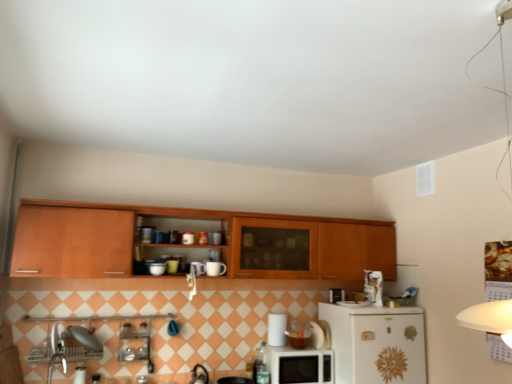
At what (x,y) coordinates should I click in order to perform the action: click on white glossy microwave at center. Please return your answer as a coordinate pair (x, y). This screenshot has height=384, width=512. Looking at the image, I should click on (277, 329).

What do you see at coordinates (195, 242) in the screenshot? I see `wooden cabinet at upper center` at bounding box center [195, 242].

Identify the location of white glossy microwave at lower center. This screenshot has height=384, width=512. (298, 365).

The height and width of the screenshot is (384, 512). In order to click on white glossy microwave at center in this screenshot , I will do (277, 329).

Is white glossy refrigerator at lower right oriented towards white glossy microwave at center?

No, white glossy refrigerator at lower right is not oriented towards white glossy microwave at center.

Who is taller, white glossy refrigerator at lower right or white glossy microwave at center?

Standing taller between the two is white glossy refrigerator at lower right.

Is the position of white glossy refrigerator at lower right less distant than that of white glossy microwave at center?

Yes.

Looking at this image, can you confirm if white glossy refrigerator at lower right is bigger than white glossy microwave at center?

Correct, white glossy refrigerator at lower right is larger in size than white glossy microwave at center.

Is wooden cabinet at upper center closer to the viewer compared to white glossy microwave at center?

Yes.

How much distance is there between wooden cabinet at upper center and white glossy microwave at center?

wooden cabinet at upper center and white glossy microwave at center are 33.82 inches apart from each other.

How many degrees apart are the facing directions of wooden cabinet at upper center and white glossy microwave at center?

The angular difference between wooden cabinet at upper center and white glossy microwave at center is 1.99 degrees.

Is point (87, 224) behind point (283, 345)?

No, (87, 224) is closer to viewer.

Is white glossy microwave at lower center positioned far away from white glossy microwave at center?

Actually, white glossy microwave at lower center and white glossy microwave at center are a little close together.

Considering the relative positions of white glossy microwave at lower center and white glossy microwave at center in the image provided, is white glossy microwave at lower center in front of white glossy microwave at center?

That is True.

Which is nearer, [308,373] or [272,331]?

Clearly, point [308,373] is closer to the camera than point [272,331].

From the image's perspective, relative to white glossy microwave at center, is white glossy microwave at lower center above or below?

From the image's perspective, white glossy microwave at lower center appears below white glossy microwave at center.

Which object is more forward, wooden cabinet at upper center or white glossy microwave at lower center?

Positioned in front is wooden cabinet at upper center.

From the image's perspective, relative to white glossy microwave at lower center, is wooden cabinet at upper center above or below?

wooden cabinet at upper center is above white glossy microwave at lower center.

Between point (382, 229) and point (325, 370), which one is positioned behind?

The point (382, 229) is more distant.

Considering the relative positions of wooden cabinet at upper center and white glossy refrigerator at lower right in the image provided, is wooden cabinet at upper center to the right of white glossy refrigerator at lower right from the viewer's perspective?

In fact, wooden cabinet at upper center is to the left of white glossy refrigerator at lower right.

Can you confirm if wooden cabinet at upper center is shorter than white glossy refrigerator at lower right?

Indeed, wooden cabinet at upper center has a lesser height compared to white glossy refrigerator at lower right.

From the picture: Would you say wooden cabinet at upper center is outside white glossy refrigerator at lower right?

Yes, wooden cabinet at upper center is outside of white glossy refrigerator at lower right.

Identify the location of cabinetry that appears in front of the white glossy refrigerator at lower right. (195, 242).

Which object is positioned more to the left, white glossy microwave at lower center or white glossy refrigerator at lower right?

Positioned to the left is white glossy microwave at lower center.

Measure the distance between white glossy microwave at lower center and white glossy refrigerator at lower right.

The distance of white glossy microwave at lower center from white glossy refrigerator at lower right is 36.40 centimeters.

From a real-world perspective, is white glossy microwave at lower center over white glossy refrigerator at lower right?

Incorrect, from a real-world perspective, white glossy microwave at lower center is lower than white glossy refrigerator at lower right.

Is white glossy microwave at lower center closer to camera compared to white glossy refrigerator at lower right?

No.

Is white glossy microwave at lower center located outside wooden cabinet at upper center?

white glossy microwave at lower center lies outside wooden cabinet at upper center's area.

Considering the relative sizes of white glossy microwave at lower center and wooden cabinet at upper center in the image provided, is white glossy microwave at lower center thinner than wooden cabinet at upper center?

→ Yes.

Does white glossy microwave at lower center have a greater height compared to wooden cabinet at upper center?

Incorrect, the height of white glossy microwave at lower center is not larger of that of wooden cabinet at upper center.

Which object is closer to the camera, white glossy microwave at lower center or wooden cabinet at upper center?

wooden cabinet at upper center is in front.

Find the location of `appliance above the white glossy refrigerator at lower right (from a real-world perspective)`. appliance above the white glossy refrigerator at lower right (from a real-world perspective) is located at coordinates (277, 329).

At what (x,y) coordinates should I click in order to perform the action: click on cabinetry above the white glossy microwave at center (from the image's perspective). Please return your answer as a coordinate pair (x, y). Looking at the image, I should click on (195, 242).

From the picture: Looking at the image, which one is located closer to white glossy microwave at lower center, white glossy microwave at center or white glossy refrigerator at lower right?

white glossy microwave at center lies closer to white glossy microwave at lower center than the other object.

From the image, which object appears to be farther from white glossy microwave at lower center, wooden cabinet at upper center or white glossy microwave at center?

The object further to white glossy microwave at lower center is wooden cabinet at upper center.

When comparing their distances from white glossy microwave at lower center, does wooden cabinet at upper center or white glossy refrigerator at lower right seem closer?

white glossy refrigerator at lower right.

Estimate the real-world distances between objects in this image. Which object is further from white glossy microwave at lower center, white glossy microwave at center or wooden cabinet at upper center?

Among the two, wooden cabinet at upper center is located further to white glossy microwave at lower center.

From the image, which object appears to be farther from white glossy microwave at center, white glossy refrigerator at lower right or white glossy microwave at lower center?

Based on the image, white glossy refrigerator at lower right appears to be further to white glossy microwave at center.

Looking at the image, which one is located closer to wooden cabinet at upper center, white glossy microwave at lower center or white glossy microwave at center?

Based on the image, white glossy microwave at lower center appears to be nearer to wooden cabinet at upper center.

Looking at the image, which one is located closer to white glossy refrigerator at lower right, wooden cabinet at upper center or white glossy microwave at lower center?

white glossy microwave at lower center.

When comparing their distances from white glossy microwave at center, does white glossy refrigerator at lower right or wooden cabinet at upper center seem further?

Based on the image, wooden cabinet at upper center appears to be further to white glossy microwave at center.

The height and width of the screenshot is (384, 512). Identify the location of microwave oven located between wooden cabinet at upper center and white glossy refrigerator at lower right in the left-right direction. (298, 365).

What are the coordinates of `microwave oven between white glossy microwave at center and white glossy refrigerator at lower right from left to right` in the screenshot? It's located at (298, 365).

This screenshot has height=384, width=512. In order to click on appliance between wooden cabinet at upper center and white glossy microwave at lower center in the vertical direction in this screenshot , I will do `click(277, 329)`.

In order to click on appliance between wooden cabinet at upper center and white glossy refrigerator at lower right in this screenshot , I will do `click(277, 329)`.